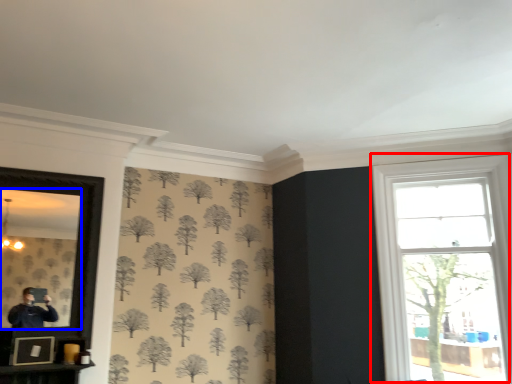
Question: Which object is closer to the camera taking this photo, window (highlighted by a red box) or mirror (highlighted by a blue box)?

Choices:
 (A) window
 (B) mirror

Answer: (B)